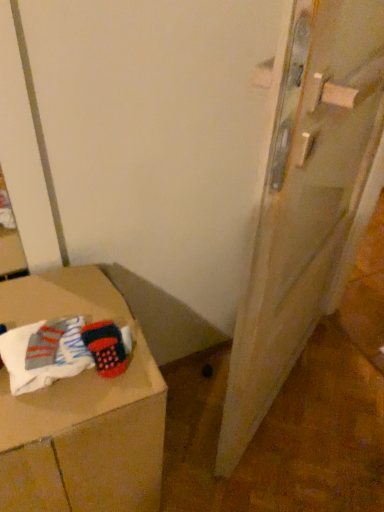
I want to click on vacant area that is in front of white cotton socks at lower left, so click(46, 414).